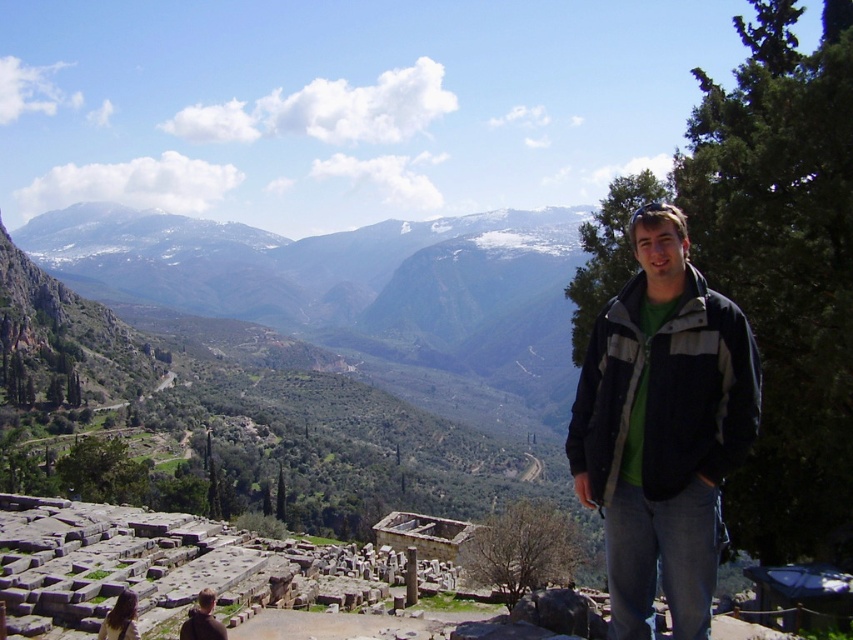
Question: Is dark gray textured jacket at right below brown hair at lower left?

Choices:
 (A) yes
 (B) no

Answer: (B)

Question: Considering the relative positions of dark gray textured jacket at right and brown hair at lower left in the image provided, where is dark gray textured jacket at right located with respect to brown hair at lower left?

Choices:
 (A) above
 (B) below

Answer: (A)

Question: Which point is farther to the camera?

Choices:
 (A) (206, 627)
 (B) (694, 468)

Answer: (A)

Question: Among these points, which one is nearest to the camera?

Choices:
 (A) coord(213,618)
 (B) coord(582,417)

Answer: (B)

Question: Can you confirm if dark gray textured jacket at right is wider than brown hair at lower left?

Choices:
 (A) yes
 (B) no

Answer: (A)